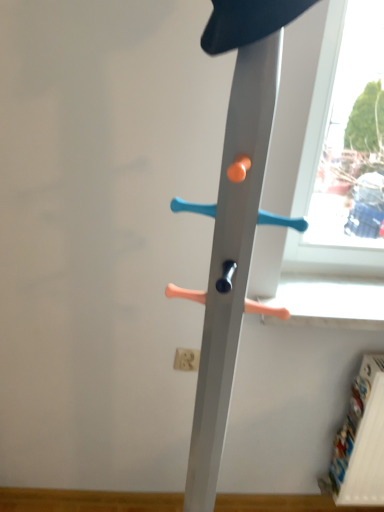
Question: In which direction should I rotate to look at white matte electric outlet at lower center?

Choices:
 (A) right
 (B) left

Answer: (B)

Question: Can you confirm if white matte electric outlet at lower center is taller than metal coat rack at center?

Choices:
 (A) no
 (B) yes

Answer: (A)

Question: Considering the relative sizes of white matte electric outlet at lower center and metal coat rack at center in the image provided, is white matte electric outlet at lower center thinner than metal coat rack at center?

Choices:
 (A) yes
 (B) no

Answer: (A)

Question: Is white matte electric outlet at lower center to the right of metal coat rack at center from the viewer's perspective?

Choices:
 (A) yes
 (B) no

Answer: (B)

Question: Is metal coat rack at center completely or partially inside white matte electric outlet at lower center?

Choices:
 (A) yes
 (B) no

Answer: (B)

Question: From the image's perspective, is white matte electric outlet at lower center above metal coat rack at center?

Choices:
 (A) yes
 (B) no

Answer: (B)

Question: Is metal coat rack at center at the back of white matte electric outlet at lower center?

Choices:
 (A) no
 (B) yes

Answer: (A)

Question: Does metal coat rack at center have a greater width compared to white matte electric outlet at lower center?

Choices:
 (A) yes
 (B) no

Answer: (A)

Question: From a real-world perspective, is metal coat rack at center positioned under white matte electric outlet at lower center based on gravity?

Choices:
 (A) yes
 (B) no

Answer: (B)

Question: Can we say metal coat rack at center lies outside white matte electric outlet at lower center?

Choices:
 (A) no
 (B) yes

Answer: (B)

Question: Is metal coat rack at center bigger than white matte electric outlet at lower center?

Choices:
 (A) no
 (B) yes

Answer: (B)

Question: Does metal coat rack at center have a lesser width compared to white matte electric outlet at lower center?

Choices:
 (A) yes
 (B) no

Answer: (B)

Question: Can you confirm if metal coat rack at center is shorter than white matte electric outlet at lower center?

Choices:
 (A) no
 (B) yes

Answer: (A)

Question: Based on their sizes in the image, would you say metal coat rack at center is bigger or smaller than white matte electric outlet at lower center?

Choices:
 (A) big
 (B) small

Answer: (A)